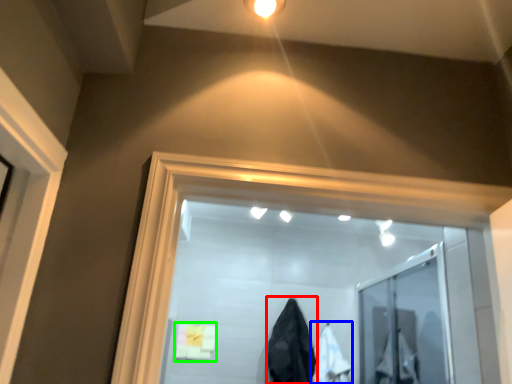
Question: Based on their relative distances, which object is farther from garment (highlighted by a red box)? Choose from garment (highlighted by a blue box) and bath towel (highlighted by a green box).

Choices:
 (A) garment
 (B) bath towel

Answer: (B)